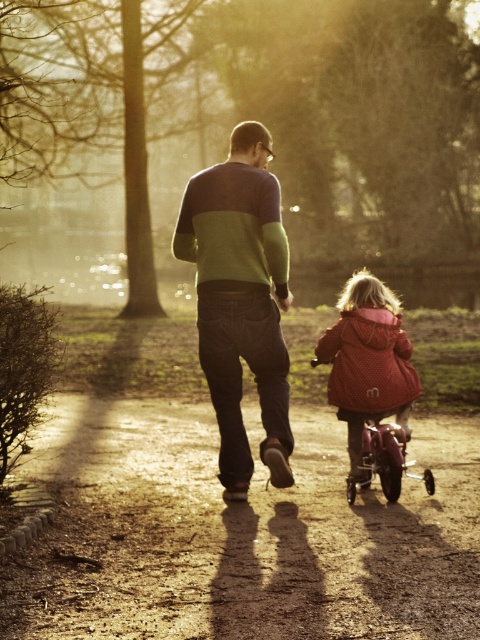
What do you see at coordinates (242, 502) in the screenshot?
I see `dirt path at center` at bounding box center [242, 502].

Does dirt path at center appear under matte pink coat at center?

Correct, dirt path at center is located below matte pink coat at center.

What do you see at coordinates (242, 502) in the screenshot?
I see `dirt path at center` at bounding box center [242, 502].

Find the location of a particular element. The image size is (480, 640). dirt path at center is located at coordinates (242, 502).

Is the position of dirt path at center less distant than that of metallic pink baby carriage at lower right?

Yes, dirt path at center is closer to the viewer.

I want to click on dirt path at center, so click(x=242, y=502).

Does point (393, 540) lie behind point (389, 499)?

No, (393, 540) is closer to viewer.

Identify the location of dirt path at center. Image resolution: width=480 pixels, height=640 pixels. (242, 502).

Is green sweater at center bigger than matte pink coat at center?

Yes, green sweater at center is bigger than matte pink coat at center.

Can you confirm if green sweater at center is positioned to the right of matte pink coat at center?

No, green sweater at center is not to the right of matte pink coat at center.

Which is in front, point (279, 289) or point (360, 340)?

Point (279, 289)

Locate an element on the screen. green sweater at center is located at coordinates (240, 300).